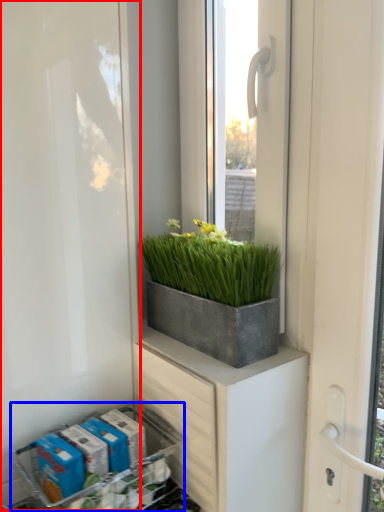
Question: Which object is closer to the camera taking this photo, screen door (highlighted by a red box) or flower box (highlighted by a blue box)?

Choices:
 (A) screen door
 (B) flower box

Answer: (A)